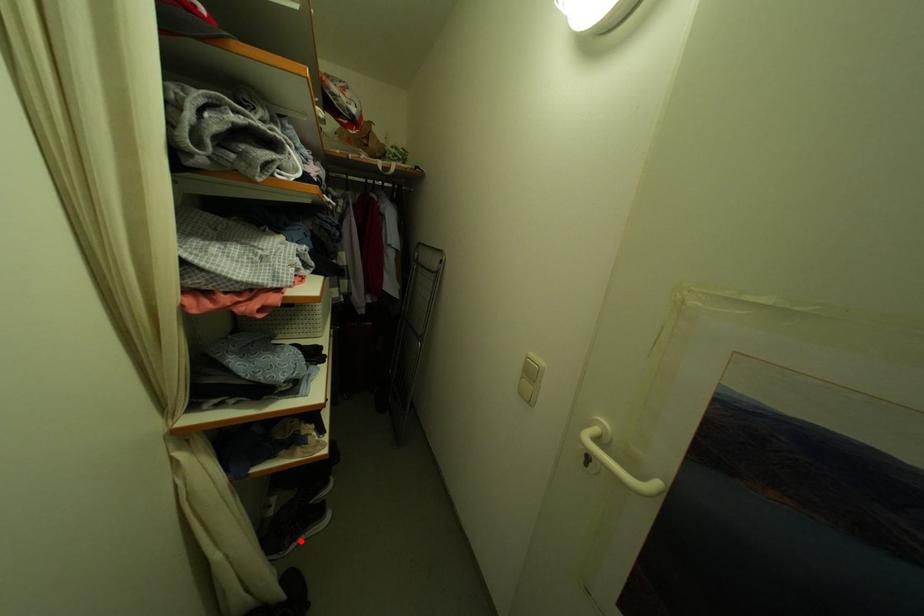
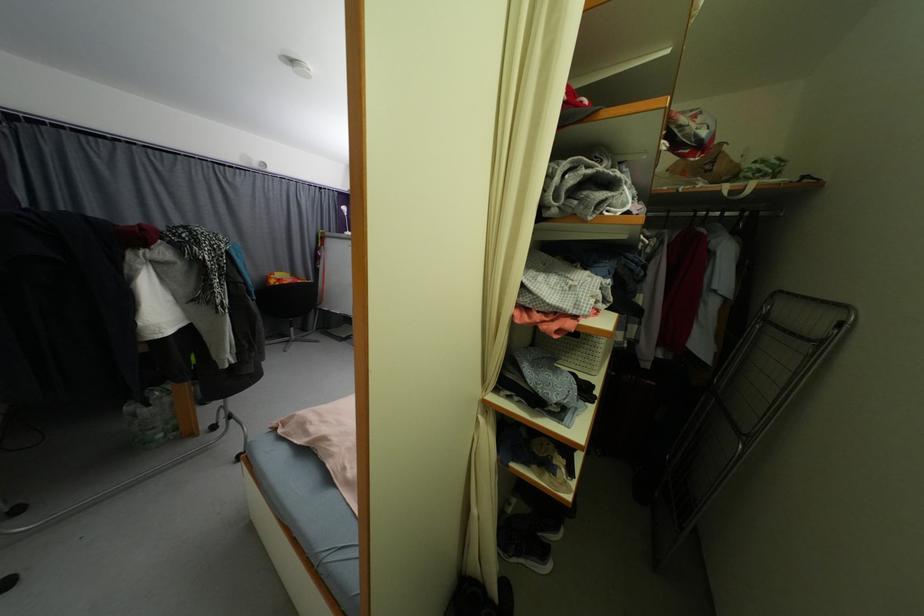
Question: I am providing you with two images of the same scene from different viewpoints. Image1 has a red point marked. In image2, the corresponding 3D location appears at what relative position? Reply with the corresponding letter.

Choices:
 (A) Closer
 (B) Farther

Answer: (B)